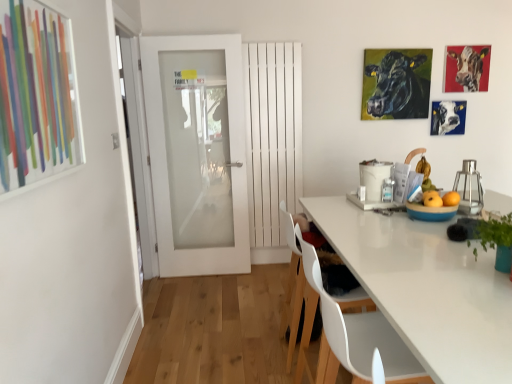
Image resolution: width=512 pixels, height=384 pixels. What do you see at coordinates (495, 231) in the screenshot?
I see `green glossy plant at right` at bounding box center [495, 231].

This screenshot has height=384, width=512. Describe the element at coordinates (438, 197) in the screenshot. I see `yellow matte apple at right` at that location.

The height and width of the screenshot is (384, 512). I want to click on blue glossy cow at upper right, placed as the second cattle when sorted from right to left, so click(448, 117).

Describe the element at coordinates (469, 67) in the screenshot. I see `painted cow at upper right, the 3th cattle when ordered from left to right` at that location.

This screenshot has width=512, height=384. What are the coordinates of `white matte radiator at center, arranged as the second door when viewed from the left` in the screenshot? It's located at (272, 135).

Would you say white matte radiator at center, acting as the first door starting from the right, is part of blue glossy cow at upper right, placed as the second cattle when sorted from right to left,'s contents?

No.

Considering the positions of objects blue glossy cow at upper right, placed as the second cattle when sorted from right to left, and white matte radiator at center, arranged as the second door when viewed from the left, in the image provided, who is in front, blue glossy cow at upper right, placed as the second cattle when sorted from right to left, or white matte radiator at center, arranged as the second door when viewed from the left,?

white matte radiator at center, arranged as the second door when viewed from the left.

Which point is more distant from viewer, (x=463, y=108) or (x=246, y=46)?

The point (x=463, y=108) is farther from the camera.

The width and height of the screenshot is (512, 384). I want to click on door that is the 1st object directly below the blue glossy cow at upper right, which is the second cattle in left-to-right order (from a real-world perspective), so click(272, 135).

Is white matte radiator at center, arranged as the second door when viewed from the left, wider than green glossy plant at right?

Incorrect, the width of white matte radiator at center, arranged as the second door when viewed from the left, does not surpass that of green glossy plant at right.

From a real-world perspective, is white matte radiator at center, arranged as the second door when viewed from the left, positioned under green glossy plant at right based on gravity?

No, from a real-world perspective, white matte radiator at center, arranged as the second door when viewed from the left, is not beneath green glossy plant at right.

Is white matte radiator at center, arranged as the second door when viewed from the left, surrounding green glossy plant at right?

No, green glossy plant at right is located outside of white matte radiator at center, arranged as the second door when viewed from the left.

Does white matte radiator at center, acting as the first door starting from the right, have a smaller size compared to green glossy plant at right?

Actually, white matte radiator at center, acting as the first door starting from the right, might be larger than green glossy plant at right.

Looking at this image, can white plastic chair at lower center, the 1th chair positioned from the back, be found inside black glossy cattle at upper right, the 1th cattle from the left?

No, white plastic chair at lower center, the 1th chair positioned from the back, is located outside of black glossy cattle at upper right, the 1th cattle from the left.

From a real-world perspective, which object stands above the other?

black glossy cattle at upper right, the 1th cattle from the left, is physically above.

From the image's perspective, which one is positioned lower, black glossy cattle at upper right, the 3th cattle positioned from the right, or white plastic chair at lower center, which is counted as the second chair, starting from the front?

white plastic chair at lower center, which is counted as the second chair, starting from the front, is shown below in the image.

Between yellow matte apple at right and white matte radiator at center, acting as the first door starting from the right, which one is positioned in front?

Positioned in front is yellow matte apple at right.

From a real-world perspective, between yellow matte apple at right and white matte radiator at center, acting as the first door starting from the right, who is vertically higher?

white matte radiator at center, acting as the first door starting from the right.

Could you tell me if yellow matte apple at right is facing white matte radiator at center, arranged as the second door when viewed from the left?

No, yellow matte apple at right is not aimed at white matte radiator at center, arranged as the second door when viewed from the left.

In the scene shown: Between yellow matte apple at right and white matte radiator at center, acting as the first door starting from the right, which one has less height?

yellow matte apple at right.

This screenshot has height=384, width=512. I want to click on plant on the right of white plastic chair at lower center, which is the first chair from front to back, so click(495, 231).

Considering the points (388, 369) and (511, 212), which point is in front, point (388, 369) or point (511, 212)?

Point (388, 369)

Is white plastic chair at lower center, which is the first chair from front to back, looking in the opposite direction of green glossy plant at right?

No, white plastic chair at lower center, which is the first chair from front to back,'s orientation is not away from green glossy plant at right.

Can you see green glossy plant at right touching white matte radiator at center, arranged as the second door when viewed from the left?

No, green glossy plant at right is not touching white matte radiator at center, arranged as the second door when viewed from the left.

Measure the distance between green glossy plant at right and white matte radiator at center, acting as the first door starting from the right.

A distance of 7.45 feet exists between green glossy plant at right and white matte radiator at center, acting as the first door starting from the right.

Considering the sizes of objects green glossy plant at right and white matte radiator at center, arranged as the second door when viewed from the left, in the image provided, who is shorter, green glossy plant at right or white matte radiator at center, arranged as the second door when viewed from the left,?

green glossy plant at right.

Which point is more forward, (510, 212) or (256, 233)?

The point (510, 212) is closer to the camera.

Considering the sizes of metallic glass container at right and green glossy plant at right in the image, is metallic glass container at right bigger or smaller than green glossy plant at right?

Clearly, metallic glass container at right is larger in size than green glossy plant at right.

From the image's perspective, relative to green glossy plant at right, is metallic glass container at right above or below?

From the image's perspective, metallic glass container at right appears above green glossy plant at right.

Can you tell me how much metallic glass container at right and green glossy plant at right differ in facing direction?

metallic glass container at right and green glossy plant at right are facing 1.54 degrees away from each other.

From a real-world perspective, which object stands above the other?

From a 3D spatial view, metallic glass container at right is above.

Starting from the blue glossy cow at upper right, placed as the second cattle when sorted from right to left, which door is the 1st one to the left? Please provide its 2D coordinates.

[(272, 135)]

Locate an element on the screen. plant in front of the white matte radiator at center, acting as the first door starting from the right is located at coordinates (495, 231).

Consider the image. Estimate the real-world distances between objects in this image. Which object is further from green glossy plant at right, white frosted glass door at center, the first door in the left-to-right sequence, or black glossy cattle at upper right, the 3th cattle positioned from the right?

The object further to green glossy plant at right is white frosted glass door at center, the first door in the left-to-right sequence.

From the picture: When comparing their distances from blue glossy cow at upper right, which is the second cattle in left-to-right order, does white frosted glass door at center, which appears as the 2th door when viewed from the right, or metallic glass container at right seem closer?

The object closer to blue glossy cow at upper right, which is the second cattle in left-to-right order, is metallic glass container at right.

Estimate the real-world distances between objects in this image. Which object is closer to white matte radiator at center, acting as the first door starting from the right, white plastic chair at lower center, which is counted as the second chair, starting from the front, or metallic glass container at right?

metallic glass container at right is positioned closer to the anchor white matte radiator at center, acting as the first door starting from the right.

Looking at the image, which one is located closer to white plastic chair at lower center, the second chair from the back, blue glossy bowl at right or yellow matte apple at right?

Among the two, blue glossy bowl at right is located nearer to white plastic chair at lower center, the second chair from the back.

Estimate the real-world distances between objects in this image. Which object is further from white plastic chair at lower center, the second chair from the back, metallic glass container at right or green glossy plant at right?

metallic glass container at right is positioned further to the anchor white plastic chair at lower center, the second chair from the back.

Considering their positions, is blue glossy bowl at right positioned closer to white plastic chair at lower center, the 1th chair positioned from the back, than white plastic chair at lower center, the second chair from the back?

Among the two, white plastic chair at lower center, the second chair from the back, is located nearer to white plastic chair at lower center, the 1th chair positioned from the back.

When comparing their distances from white matte radiator at center, arranged as the second door when viewed from the left, does black glossy cattle at upper right, the 1th cattle from the left, or blue glossy bowl at right seem further?

blue glossy bowl at right lies further to white matte radiator at center, arranged as the second door when viewed from the left, than the other object.

Looking at the image, which one is located closer to white plastic chair at lower center, the 1th chair positioned from the back, painted cow at upper right, acting as the 1th cattle starting from the right, or green glossy plant at right?

green glossy plant at right is positioned closer to the anchor white plastic chair at lower center, the 1th chair positioned from the back.

Identify the location of fruit between white plastic chair at lower center, the second chair from the back, and white matte radiator at center, arranged as the second door when viewed from the left, along the z-axis. (438, 197).

Locate an element on the screen. This screenshot has height=384, width=512. chair positioned between white plastic chair at lower center, the second chair from the back, and white matte radiator at center, acting as the first door starting from the right, from near to far is located at coordinates (300, 313).

This screenshot has height=384, width=512. Find the location of `cattle located between white matte radiator at center, arranged as the second door when viewed from the left, and blue glossy cow at upper right, placed as the second cattle when sorted from right to left, in the left-right direction`. cattle located between white matte radiator at center, arranged as the second door when viewed from the left, and blue glossy cow at upper right, placed as the second cattle when sorted from right to left, in the left-right direction is located at coordinates (396, 84).

What are the coordinates of `appliance located between green glossy plant at right and black glossy cattle at upper right, the 3th cattle positioned from the right, in the depth direction` in the screenshot? It's located at (469, 188).